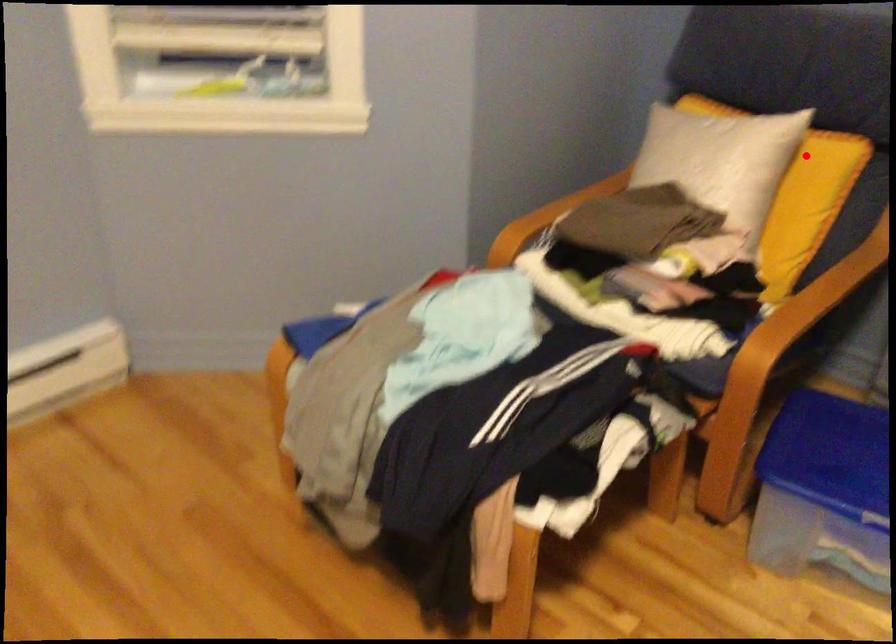
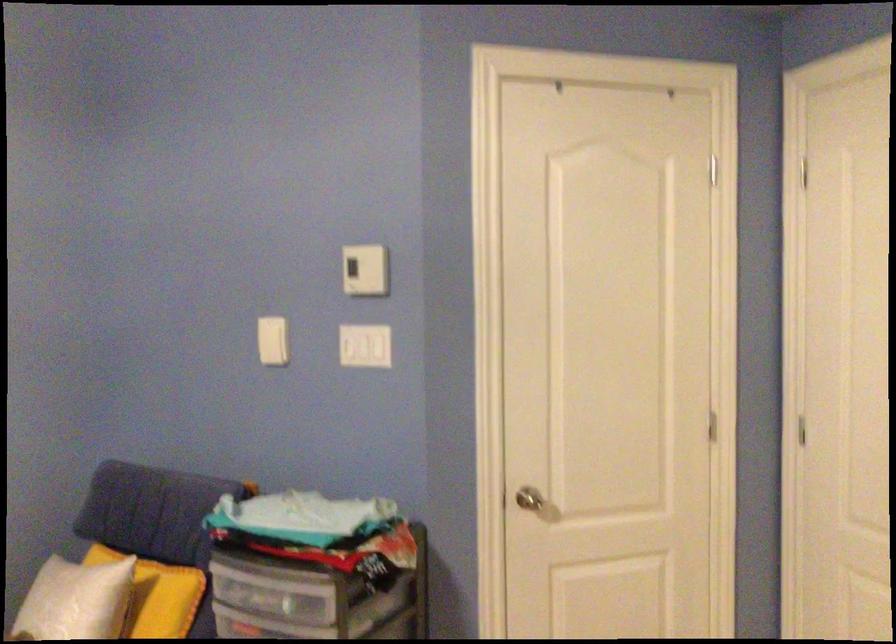
Question: I am providing you with two images of the same scene from different viewpoints. A red point is shown in image1. For the corresponding object point in image2, is it positioned nearer or farther from the camera?

Choices:
 (A) Nearer
 (B) Farther

Answer: (B)